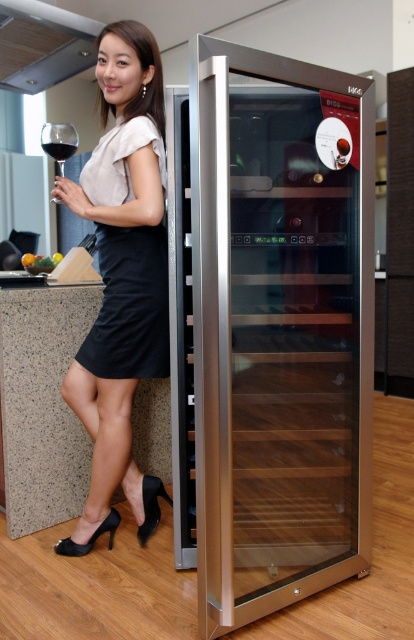
You are a GUI agent. You are given a task and a screenshot of the screen. Output one action in this format:
    pyautogui.click(x=<x>, y=<y>)
    Task: Click on the satin silver wine cooler at right
    The height and width of the screenshot is (640, 414).
    Given the screenshot: What is the action you would take?
    point(269,328)

Who is more distant from viewer, (159, 291) or (74, 141)?

Point (74, 141)

Can you confirm if black satin dress at left is positioned above dark red liquid at upper left?

No.

Describe the element at coordinates (129, 305) in the screenshot. I see `black satin dress at left` at that location.

I want to click on black satin dress at left, so click(x=129, y=305).

Is point (113, 132) behind point (36, 259)?

No.

Image resolution: width=414 pixels, height=640 pixels. Identify the location of black satin dress at left. (129, 305).

Where is `black satin dress at left`? This screenshot has height=640, width=414. black satin dress at left is located at coordinates (129, 305).

Identify the location of black satin dress at left. Image resolution: width=414 pixels, height=640 pixels. (129, 305).